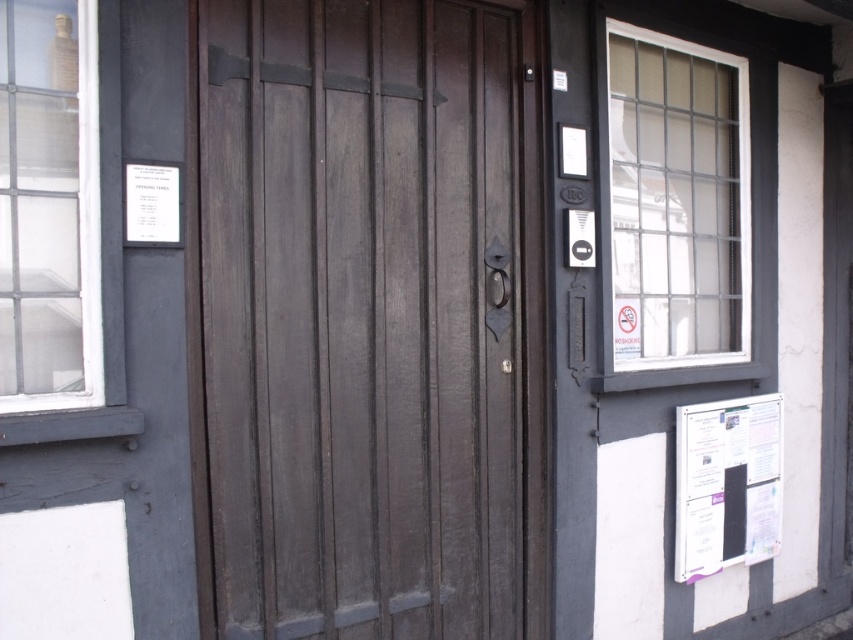
Which is in front, point (637, 378) or point (105, 387)?

Point (105, 387) is more forward.

Which of these two, clear glass window at upper right or clear glass window at upper left, stands shorter?

clear glass window at upper left is shorter.

Find the location of `clear glass window at upper right`. clear glass window at upper right is located at coordinates (677, 205).

Is dark wood door at center positioned at the back of white paperboard at lower right?

No, dark wood door at center is in front of white paperboard at lower right.

Who is higher up, dark wood door at center or white paperboard at lower right?

dark wood door at center is higher up.

Which is in front, point (341, 406) or point (776, 552)?

Point (341, 406)

Identify the location of dark wood door at center. click(373, 317).

Can you confirm if dark wood door at center is positioned to the left of clear glass window at upper right?

Correct, you'll find dark wood door at center to the left of clear glass window at upper right.

Looking at this image, does dark wood door at center have a lesser width compared to clear glass window at upper right?

In fact, dark wood door at center might be wider than clear glass window at upper right.

The height and width of the screenshot is (640, 853). Find the location of `dark wood door at center`. dark wood door at center is located at coordinates (373, 317).

Locate an element on the screen. The image size is (853, 640). dark wood door at center is located at coordinates (373, 317).